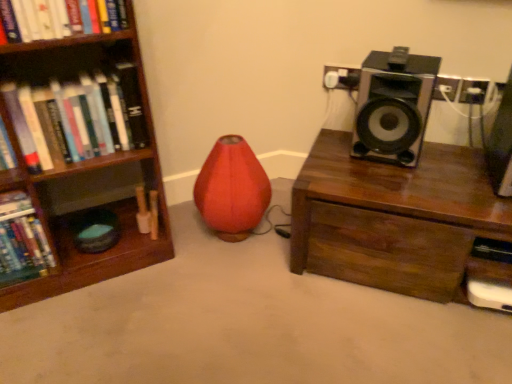
At what (x,y) coordinates should I click in order to perform the action: click on vacant area that lies between matte red bean bag chair at center and brown wooden chest at right. Please return your answer as a coordinate pair (x, y). The height and width of the screenshot is (384, 512). Looking at the image, I should click on (281, 252).